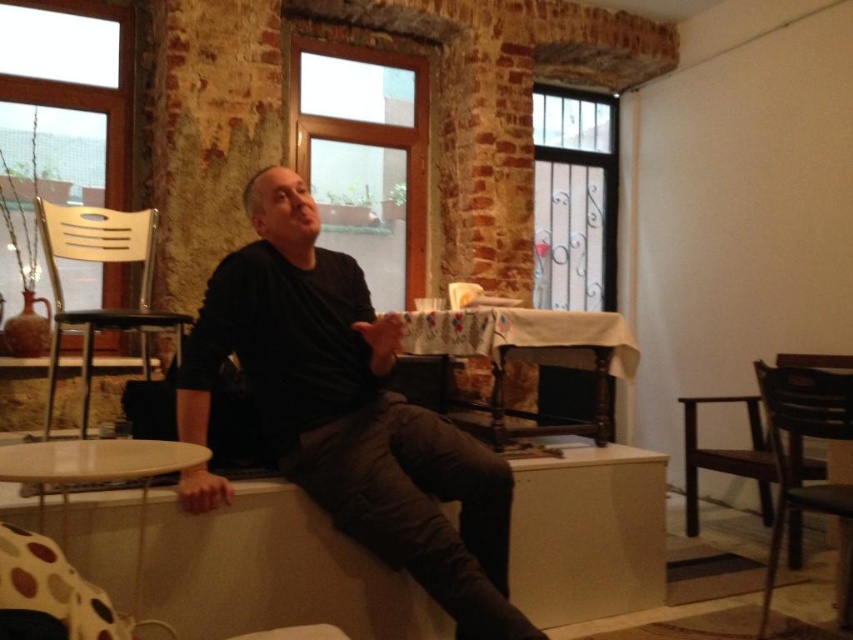
You are sitting on the white plastic chair at left and want to look outside. Which direction should you turn your head to look through the clear glass window at center?

You should turn your head to the right to look through the clear glass window at center since it is located to the right of the white plastic chair at left.

You are taking a photo of the scene and want to focus on the point that is closer to the camera. Which point should you choose between point (364, 385) and point (49, 60)?

Point (364, 385) is closer to the camera than point (49, 60), so you should focus on point (364, 385).

You are a customer in a cozy indoor setting and want to sit down. You see the black matte shirt at center and the brown wooden chair at lower right. Which object is bigger?

The black matte shirt at center is larger in size compared to the brown wooden chair at lower right.